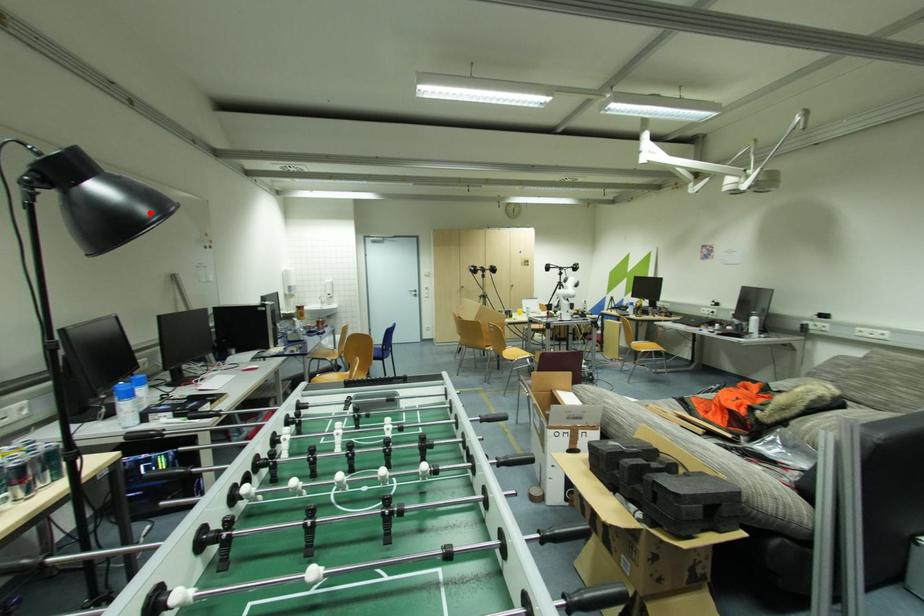
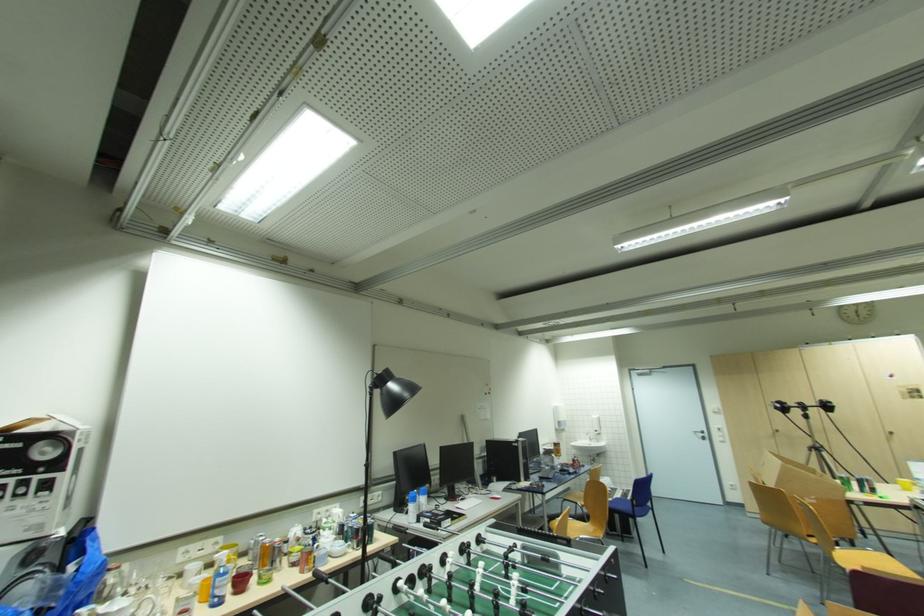
Locate, in the second image, the point that corresponds to the highlighted location in the first image.

(409, 395)